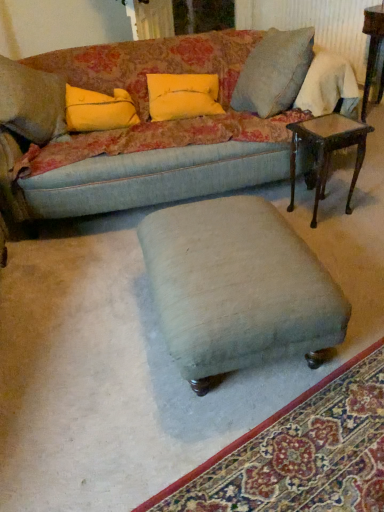
I want to click on wooden side table at upper right, the 2th table ordered from the bottom, so click(x=372, y=48).

Locate an element on the screen. mahogany wood side table at right, the 2th table when ordered from right to left is located at coordinates (327, 151).

Find the location of `yellow fabric pillow at upper left, the 2th pillow from the right`. yellow fabric pillow at upper left, the 2th pillow from the right is located at coordinates (99, 110).

What do you see at coordinates (237, 287) in the screenshot?
I see `velvet green ottoman at center` at bounding box center [237, 287].

This screenshot has height=512, width=384. What do you see at coordinates (152, 131) in the screenshot? I see `velvet fabric couch at upper center` at bounding box center [152, 131].

Where is `wooden side table at upper right, the 2th table ordered from the bottom`? The height and width of the screenshot is (512, 384). wooden side table at upper right, the 2th table ordered from the bottom is located at coordinates (372, 48).

Looking at this image, can you confirm if velvet fabric couch at upper center is thinner than velvet green ottoman at center?

In fact, velvet fabric couch at upper center might be wider than velvet green ottoman at center.

Is velvet fabric couch at upper center positioned with its back to velvet green ottoman at center?

No, velvet green ottoman at center is not at the back of velvet fabric couch at upper center.

Who is taller, velvet fabric couch at upper center or velvet green ottoman at center?

velvet fabric couch at upper center is taller.

Is velvet fabric couch at upper center not near velvet green ottoman at center?

They are positioned close to each other.

Looking at this image, considering the sizes of objects yellow fabric pillow at upper center, arranged as the 2th pillow when viewed from the left, and velvet fabric couch at upper center in the image provided, who is smaller, yellow fabric pillow at upper center, arranged as the 2th pillow when viewed from the left, or velvet fabric couch at upper center?

Smaller between the two is yellow fabric pillow at upper center, arranged as the 2th pillow when viewed from the left.

Considering the relative positions of yellow fabric pillow at upper center, arranged as the 2th pillow when viewed from the left, and velvet fabric couch at upper center in the image provided, is yellow fabric pillow at upper center, arranged as the 2th pillow when viewed from the left, to the left of velvet fabric couch at upper center from the viewer's perspective?

No, yellow fabric pillow at upper center, arranged as the 2th pillow when viewed from the left, is not to the left of velvet fabric couch at upper center.

Can you tell me how much velvet fabric couch at upper center and velvet green ottoman at center differ in facing direction?

159 degrees.

Measure the distance between velvet fabric couch at upper center and velvet green ottoman at center.

They are 1.34 meters apart.

The height and width of the screenshot is (512, 384). I want to click on mat below the velvet fabric couch at upper center (from a real-world perspective), so click(x=300, y=453).

Choose the correct answer: Is velvet fabric couch at upper center inside velvet green ottoman at center or outside it?

velvet fabric couch at upper center lies outside velvet green ottoman at center.

Looking at this image, which object is thinner, velvet green ottoman at center or wooden side table at upper right, which is counted as the first table, starting from the back?

velvet green ottoman at center.

Can you confirm if velvet green ottoman at center is bigger than wooden side table at upper right, the 2th table from the front?

No.

Does velvet green ottoman at center come in front of wooden side table at upper right, acting as the first table starting from the top?

Yes, it is.

Is yellow fabric pillow at upper left, the 2th pillow from the right, outside of yellow fabric pillow at upper center, arranged as the 2th pillow when viewed from the left?

yellow fabric pillow at upper left, the 2th pillow from the right, lies outside yellow fabric pillow at upper center, arranged as the 2th pillow when viewed from the left,'s area.

Relative to yellow fabric pillow at upper center, arranged as the 2th pillow when viewed from the left, is yellow fabric pillow at upper left, which ranks as the first pillow in left-to-right order, in front or behind?

Visually, yellow fabric pillow at upper left, which ranks as the first pillow in left-to-right order, is located behind yellow fabric pillow at upper center, arranged as the 2th pillow when viewed from the left.

From their relative heights in the image, would you say yellow fabric pillow at upper left, which ranks as the first pillow in left-to-right order, is taller or shorter than yellow fabric pillow at upper center, the first pillow when ordered from right to left?

yellow fabric pillow at upper left, which ranks as the first pillow in left-to-right order, is shorter than yellow fabric pillow at upper center, the first pillow when ordered from right to left.

In terms of width, does wooden side table at upper right, which is counted as the first table, starting from the back, look wider or thinner when compared to velvet fabric couch at upper center?

In the image, wooden side table at upper right, which is counted as the first table, starting from the back, appears to be more narrow than velvet fabric couch at upper center.

Is wooden side table at upper right, placed as the first table when sorted from right to left, oriented towards velvet fabric couch at upper center?

Yes, wooden side table at upper right, placed as the first table when sorted from right to left, faces towards velvet fabric couch at upper center.

Locate an element on the screen. studio couch on the left of the wooden side table at upper right, the 2th table ordered from the bottom is located at coordinates (152, 131).

From a real-world perspective, is wooden side table at upper right, placed as the first table when sorted from right to left, on top of velvet fabric couch at upper center?

No, from a real-world perspective, wooden side table at upper right, placed as the first table when sorted from right to left, is not over velvet fabric couch at upper center

Starting from the mahogany wood side table at right, the 2th table when ordered from right to left, which pillow is the 1st one behind? Please provide its 2D coordinates.

[(182, 96)]

Is mahogany wood side table at right, marked as the 2th table in a top-to-bottom arrangement, placed right next to yellow fabric pillow at upper center, the first pillow when ordered from right to left?

No, mahogany wood side table at right, marked as the 2th table in a top-to-bottom arrangement, is not beside yellow fabric pillow at upper center, the first pillow when ordered from right to left.

Is mahogany wood side table at right, which is the first table from front to back, inside or outside of yellow fabric pillow at upper center, arranged as the 2th pillow when viewed from the left?

The correct answer is: outside.

Which of these two, mahogany wood side table at right, marked as the 2th table in a top-to-bottom arrangement, or yellow fabric pillow at upper center, arranged as the 2th pillow when viewed from the left, is wider?

yellow fabric pillow at upper center, arranged as the 2th pillow when viewed from the left.

Identify the location of studio couch above the velvet green ottoman at center (from the image's perspective). This screenshot has height=512, width=384. point(152,131).

I want to click on studio couch below the yellow fabric pillow at upper center, the first pillow when ordered from right to left (from a real-world perspective), so click(152, 131).

From the image, which object appears to be farther from wooden side table at upper right, placed as the first table when sorted from right to left, velvet green ottoman at center or yellow fabric pillow at upper center, the first pillow when ordered from right to left?

velvet green ottoman at center lies further to wooden side table at upper right, placed as the first table when sorted from right to left, than the other object.

When comparing their distances from velvet green ottoman at center, does yellow fabric pillow at upper left, the 2th pillow from the right, or yellow fabric pillow at upper center, the first pillow when ordered from right to left, seem further?

yellow fabric pillow at upper left, the 2th pillow from the right.

Considering their positions, is mahogany wood side table at right, placed as the first table when sorted from left to right, positioned closer to velvet fabric couch at upper center than yellow fabric pillow at upper center, arranged as the 2th pillow when viewed from the left?

yellow fabric pillow at upper center, arranged as the 2th pillow when viewed from the left, is closer to velvet fabric couch at upper center.

Considering their positions, is wooden side table at upper right, the 2th table ordered from the bottom, positioned further to yellow fabric pillow at upper center, the first pillow when ordered from right to left, than velvet fabric couch at upper center?

Based on the image, wooden side table at upper right, the 2th table ordered from the bottom, appears to be further to yellow fabric pillow at upper center, the first pillow when ordered from right to left.

Considering their positions, is mahogany wood side table at right, marked as the 2th table in a top-to-bottom arrangement, positioned closer to velvet fabric couch at upper center than velvet green ottoman at center?

mahogany wood side table at right, marked as the 2th table in a top-to-bottom arrangement.

When comparing their distances from wooden side table at upper right, the 2th table from the front, does velvet green ottoman at center or velvet fabric couch at upper center seem closer?

Based on the image, velvet fabric couch at upper center appears to be nearer to wooden side table at upper right, the 2th table from the front.

When comparing their distances from velvet green ottoman at center, does yellow fabric pillow at upper center, arranged as the 2th pillow when viewed from the left, or wooden side table at upper right, placed as the first table when sorted from right to left, seem further?

wooden side table at upper right, placed as the first table when sorted from right to left, lies further to velvet green ottoman at center than the other object.

In the scene shown: Considering their positions, is wooden side table at upper right, which is counted as the first table, starting from the back, positioned closer to velvet green ottoman at center than yellow fabric pillow at upper left, the 2th pillow from the right?

The object closer to velvet green ottoman at center is yellow fabric pillow at upper left, the 2th pillow from the right.

I want to click on stool between yellow fabric pillow at upper left, which ranks as the first pillow in left-to-right order, and wooden side table at upper right, which is counted as the first table, starting from the back, from left to right, so click(237, 287).

The image size is (384, 512). I want to click on studio couch between yellow fabric pillow at upper left, the 2th pillow from the right, and mahogany wood side table at right, placed as the first table when sorted from left to right, in the horizontal direction, so click(x=152, y=131).

This screenshot has height=512, width=384. Find the location of `studio couch between yellow fabric pillow at upper center, the first pillow when ordered from right to left, and velvet green ottoman at center from top to bottom`. studio couch between yellow fabric pillow at upper center, the first pillow when ordered from right to left, and velvet green ottoman at center from top to bottom is located at coordinates (152, 131).

Identify the location of table between yellow fabric pillow at upper left, which ranks as the first pillow in left-to-right order, and velvet green ottoman at center from top to bottom. The image size is (384, 512). (327, 151).